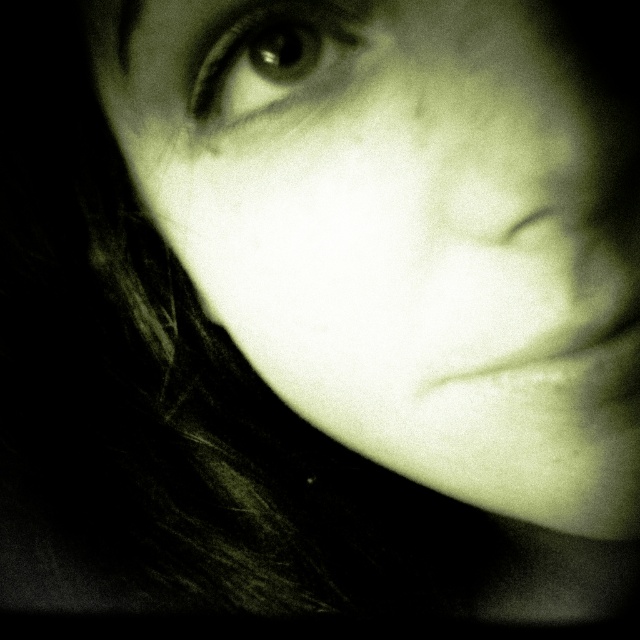
Question: Can you confirm if matte skin face at center is positioned to the right of shiny black eye at upper left?

Choices:
 (A) no
 (B) yes

Answer: (B)

Question: Is matte skin face at center to the left of shiny black eye at upper left from the viewer's perspective?

Choices:
 (A) yes
 (B) no

Answer: (B)

Question: Which of the following is the closest to the observer?

Choices:
 (A) shiny black eye at upper left
 (B) matte skin face at center

Answer: (B)

Question: Does matte skin face at center appear under shiny black eye at upper left?

Choices:
 (A) no
 (B) yes

Answer: (B)

Question: Which point appears closest to the camera in this image?

Choices:
 (A) (179, 184)
 (B) (292, 16)

Answer: (B)